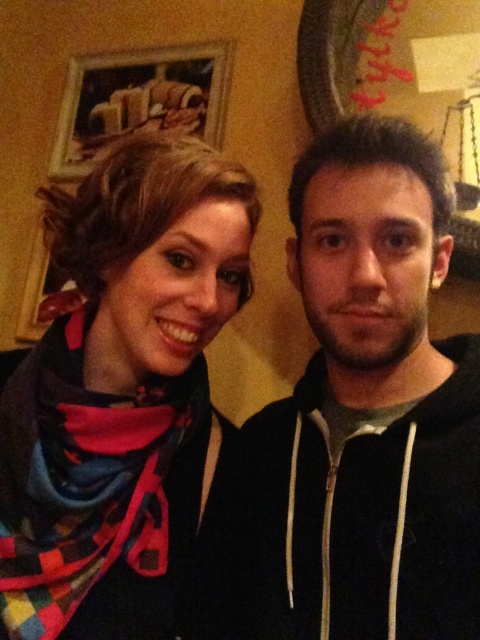
You are hanging a new picture frame on the wall between the multicolored woven scarf at left and the wooden frame at upper left. Based on their positions, which object should you place the new frame closer to?

The wooden frame at upper left is above the multicolored woven scarf at left, so placing the new frame closer to the wooden frame at upper left would maintain alignment with the upper area.

You are an interior designer assessing the space. You need to hang a new picture that is the same height as the multicolored woven scarf at left. Can you place it above the wooden frame at upper left without overlapping?

The multicolored woven scarf at left has a lesser height compared to the wooden frame at upper left. Therefore, the new picture with the same height as the scarf can be placed above the wooden frame at upper left without overlapping since it is shorter than the frame.

You are a delivery robot with a package that is 1.5 meters long. You need to move the package from the multicolored woven scarf at left to the wooden frame at upper left. Can you move the package through the space between them without bending it?

The distance between the multicolored woven scarf at left and the wooden frame at upper left is 1.40 meters. Since the package is 1.5 meters long, it is longer than the available space. Therefore, the package cannot be moved straight through without bending it.